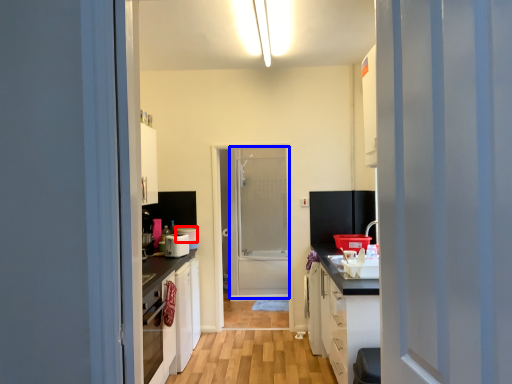
Question: Which point is further to the camera, appliance (highlighted by a red box) or screen door (highlighted by a blue box)?

Choices:
 (A) appliance
 (B) screen door

Answer: (B)